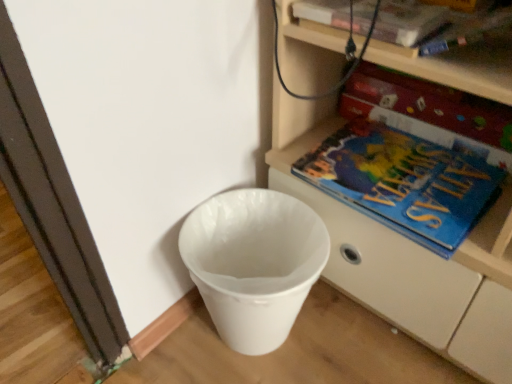
At what (x,y) coordinates should I click in order to perform the action: click on blue matte paperback book at right, which ranks as the 2th paperback book in top-to-bottom order. Please return your answer as a coordinate pair (x, y). The height and width of the screenshot is (384, 512). Looking at the image, I should click on (434, 104).

Measure the distance between point (x=240, y=310) and camera.

Point (x=240, y=310) is 73.70 centimeters from camera.

This screenshot has width=512, height=384. What are the coordinates of `hardcover book at upper center, positioned as the first paperback book in front-to-back order` in the screenshot? It's located at (407, 22).

Identify the location of blue matte atlas at lower right. (404, 182).

What do you see at coordinates (404, 182) in the screenshot? The image size is (512, 384). I see `blue matte atlas at lower right` at bounding box center [404, 182].

Where is `white plastic shelf at lower right`? This screenshot has width=512, height=384. white plastic shelf at lower right is located at coordinates (406, 256).

Locate an element on the screen. The height and width of the screenshot is (384, 512). blue matte paperback book at right, arranged as the 2th paperback book when viewed from the front is located at coordinates (434, 104).

Is the depth of hardcover book at upper center, which is the 2th paperback book in back-to-front order, less than that of blue matte paperback book at right, the 1th paperback book viewed from the back?

Yes, the depth of hardcover book at upper center, which is the 2th paperback book in back-to-front order, is less than that of blue matte paperback book at right, the 1th paperback book viewed from the back.

Who is smaller, hardcover book at upper center, which is the 2th paperback book in back-to-front order, or blue matte paperback book at right, arranged as the 2th paperback book when viewed from the front?

hardcover book at upper center, which is the 2th paperback book in back-to-front order.

Does point (307, 6) appear closer or farther from the camera than point (429, 86)?

Point (307, 6).

Is hardcover book at upper center, the 2th paperback book positioned from the bottom, far away from blue matte paperback book at right, which is the first paperback book in bottom-to-top order?

hardcover book at upper center, the 2th paperback book positioned from the bottom, is actually quite close to blue matte paperback book at right, which is the first paperback book in bottom-to-top order.

Consider the image. From the image's perspective, relative to hardcover book at upper center, positioned as the first paperback book in front-to-back order, is white plastic waste bin at lower left above or below?

Clearly, from the image's perspective, white plastic waste bin at lower left is below hardcover book at upper center, positioned as the first paperback book in front-to-back order.

In the scene shown: Would you say white plastic waste bin at lower left is outside hardcover book at upper center, positioned as the first paperback book in front-to-back order?

That's correct, white plastic waste bin at lower left is outside of hardcover book at upper center, positioned as the first paperback book in front-to-back order.

Is white plastic waste bin at lower left aimed at hardcover book at upper center, positioned as the first paperback book in front-to-back order?

No, white plastic waste bin at lower left does not turn towards hardcover book at upper center, positioned as the first paperback book in front-to-back order.

Measure the distance between white plastic waste bin at lower left and hardcover book at upper center, positioned as the first paperback book in front-to-back order.

A distance of 45.22 centimeters exists between white plastic waste bin at lower left and hardcover book at upper center, positioned as the first paperback book in front-to-back order.

Which is more distant, (407, 7) or (423, 275)?

Point (423, 275)

What's the angular difference between hardcover book at upper center, the 2th paperback book positioned from the bottom, and white plastic shelf at lower right's facing directions?

There is a 1.42-degree angle between the facing directions of hardcover book at upper center, the 2th paperback book positioned from the bottom, and white plastic shelf at lower right.

Between hardcover book at upper center, which appears as the 1th paperback book when viewed from the top, and white plastic shelf at lower right, which one has larger size?

With larger size is white plastic shelf at lower right.

How different are the orientations of white plastic waste bin at lower left and blue matte paperback book at right, arranged as the 2th paperback book when viewed from the front, in degrees?

white plastic waste bin at lower left and blue matte paperback book at right, arranged as the 2th paperback book when viewed from the front, are facing 89.7 degrees away from each other.

Is white plastic waste bin at lower left facing towards blue matte paperback book at right, which ranks as the 2th paperback book in top-to-bottom order?

No, white plastic waste bin at lower left is not turned towards blue matte paperback book at right, which ranks as the 2th paperback book in top-to-bottom order.

Do you think white plastic waste bin at lower left is within blue matte paperback book at right, which is the first paperback book in bottom-to-top order, or outside of it?

white plastic waste bin at lower left lies outside blue matte paperback book at right, which is the first paperback book in bottom-to-top order.

Is white plastic waste bin at lower left wider than blue matte paperback book at right, which is the first paperback book in bottom-to-top order?

Indeed, white plastic waste bin at lower left has a greater width compared to blue matte paperback book at right, which is the first paperback book in bottom-to-top order.

Considering the sizes of white plastic shelf at lower right and blue matte paperback book at right, which ranks as the 2th paperback book in top-to-bottom order, in the image, is white plastic shelf at lower right wider or thinner than blue matte paperback book at right, which ranks as the 2th paperback book in top-to-bottom order,?

Clearly, white plastic shelf at lower right has more width compared to blue matte paperback book at right, which ranks as the 2th paperback book in top-to-bottom order.

Which of these two, white plastic shelf at lower right or blue matte paperback book at right, which is the first paperback book in bottom-to-top order, stands shorter?

blue matte paperback book at right, which is the first paperback book in bottom-to-top order, is shorter.

Consider the image. Which object is positioned more to the right, white plastic shelf at lower right or blue matte paperback book at right, the 1th paperback book viewed from the back?

Positioned to the right is white plastic shelf at lower right.

Looking at the image, does white plastic shelf at lower right seem bigger or smaller compared to blue matte paperback book at right, the 1th paperback book viewed from the back?

Clearly, white plastic shelf at lower right is larger in size than blue matte paperback book at right, the 1th paperback book viewed from the back.

From the picture: From a real-world perspective, between white plastic shelf at lower right and blue matte atlas at lower right, who is vertically higher?

From a 3D spatial view, white plastic shelf at lower right is above.

Could you tell me if white plastic shelf at lower right is turned towards blue matte atlas at lower right?

Yes, white plastic shelf at lower right is turned towards blue matte atlas at lower right.

Is white plastic shelf at lower right wider or thinner than blue matte atlas at lower right?

Considering their sizes, white plastic shelf at lower right looks broader than blue matte atlas at lower right.

Measure the distance between white plastic shelf at lower right and blue matte atlas at lower right.

white plastic shelf at lower right and blue matte atlas at lower right are 4.23 inches apart from each other.

Who is more distant, blue matte paperback book at right, which is the first paperback book in bottom-to-top order, or blue matte atlas at lower right?

Positioned behind is blue matte paperback book at right, which is the first paperback book in bottom-to-top order.

Is there a large distance between blue matte paperback book at right, which is the first paperback book in bottom-to-top order, and blue matte atlas at lower right?

That's not correct — blue matte paperback book at right, which is the first paperback book in bottom-to-top order, is a little close to blue matte atlas at lower right.

From a real-world perspective, does blue matte paperback book at right, arranged as the 2th paperback book when viewed from the front, stand above blue matte atlas at lower right?

Yes, from a real-world perspective, blue matte paperback book at right, arranged as the 2th paperback book when viewed from the front, is on top of blue matte atlas at lower right.

In the scene shown: Considering the sizes of objects blue matte paperback book at right, the 1th paperback book viewed from the back, and blue matte atlas at lower right in the image provided, who is wider, blue matte paperback book at right, the 1th paperback book viewed from the back, or blue matte atlas at lower right?

Wider between the two is blue matte atlas at lower right.

The height and width of the screenshot is (384, 512). In order to click on paperback book below the hardcover book at upper center, positioned as the first paperback book in front-to-back order (from a real-world perspective) in this screenshot , I will do `click(434, 104)`.

From a real-world perspective, starting from the white plastic waste bin at lower left, which paperback book is the 2nd one vertically above it? Please provide its 2D coordinates.

[(407, 22)]

When comparing their distances from white plastic shelf at lower right, does white plastic waste bin at lower left or blue matte paperback book at right, arranged as the 2th paperback book when viewed from the front, seem further?

The object further to white plastic shelf at lower right is blue matte paperback book at right, arranged as the 2th paperback book when viewed from the front.

Estimate the real-world distances between objects in this image. Which object is closer to blue matte atlas at lower right, white plastic shelf at lower right or white plastic waste bin at lower left?

The object closer to blue matte atlas at lower right is white plastic shelf at lower right.

Based on their spatial positions, is white plastic waste bin at lower left or hardcover book at upper center, which is the 2th paperback book in back-to-front order, closer to blue matte paperback book at right, arranged as the 2th paperback book when viewed from the front?

hardcover book at upper center, which is the 2th paperback book in back-to-front order, lies closer to blue matte paperback book at right, arranged as the 2th paperback book when viewed from the front, than the other object.

Looking at the image, which one is located further to hardcover book at upper center, positioned as the first paperback book in front-to-back order, white plastic shelf at lower right or white plastic waste bin at lower left?

Among the two, white plastic waste bin at lower left is located further to hardcover book at upper center, positioned as the first paperback book in front-to-back order.

Which object lies nearer to the anchor point blue matte paperback book at right, the 1th paperback book viewed from the back, blue matte atlas at lower right or white plastic shelf at lower right?

blue matte atlas at lower right lies closer to blue matte paperback book at right, the 1th paperback book viewed from the back, than the other object.

Based on their spatial positions, is white plastic shelf at lower right or white plastic waste bin at lower left further from blue matte paperback book at right, which is the first paperback book in bottom-to-top order?

white plastic waste bin at lower left lies further to blue matte paperback book at right, which is the first paperback book in bottom-to-top order, than the other object.

From the image, which object appears to be farther from hardcover book at upper center, which is the 2th paperback book in back-to-front order, white plastic waste bin at lower left or blue matte paperback book at right, the 1th paperback book viewed from the back?

The object further to hardcover book at upper center, which is the 2th paperback book in back-to-front order, is white plastic waste bin at lower left.

Estimate the real-world distances between objects in this image. Which object is further from white plastic shelf at lower right, white plastic waste bin at lower left or hardcover book at upper center, which appears as the 1th paperback book when viewed from the top?

hardcover book at upper center, which appears as the 1th paperback book when viewed from the top, lies further to white plastic shelf at lower right than the other object.

Find the location of a particular element. The width and height of the screenshot is (512, 384). paperback book that lies between hardcover book at upper center, positioned as the first paperback book in front-to-back order, and blue matte atlas at lower right from top to bottom is located at coordinates (434, 104).

Find the location of a particular element. paperback book between hardcover book at upper center, the 2th paperback book positioned from the bottom, and white plastic waste bin at lower left vertically is located at coordinates (434, 104).

The width and height of the screenshot is (512, 384). I want to click on book situated between white plastic waste bin at lower left and blue matte paperback book at right, which ranks as the 2th paperback book in top-to-bottom order, from left to right, so click(x=404, y=182).

Locate an element on the screen. This screenshot has width=512, height=384. book between white plastic waste bin at lower left and white plastic shelf at lower right is located at coordinates (404, 182).